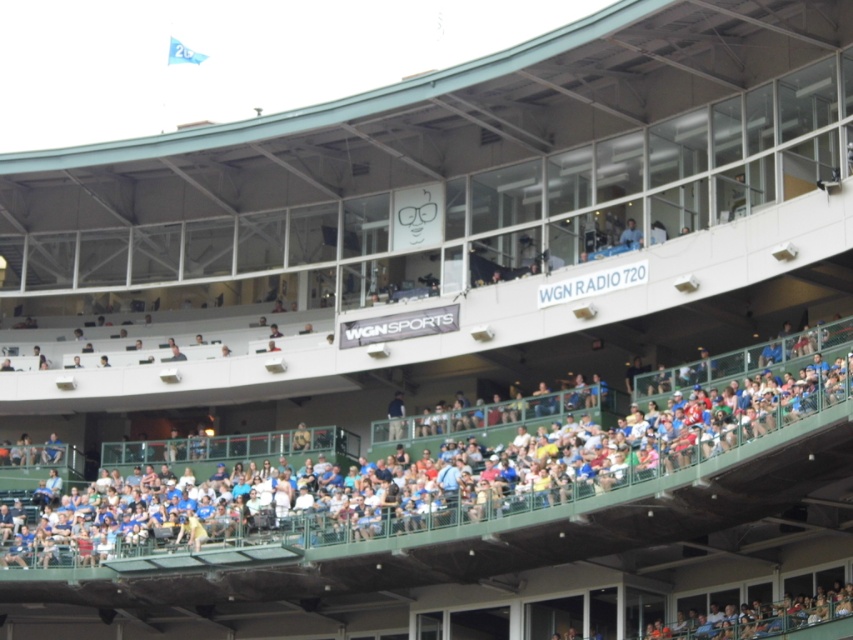
Is point (218, 477) positioned in front of point (628, 227)?

No.

Can you confirm if green plastic seats at center is positioned above blue shirt at upper center?

No.

Find the location of a particular element. The image size is (853, 640). green plastic seats at center is located at coordinates coord(447,465).

Find the location of a particular element. green plastic seats at center is located at coordinates (447, 465).